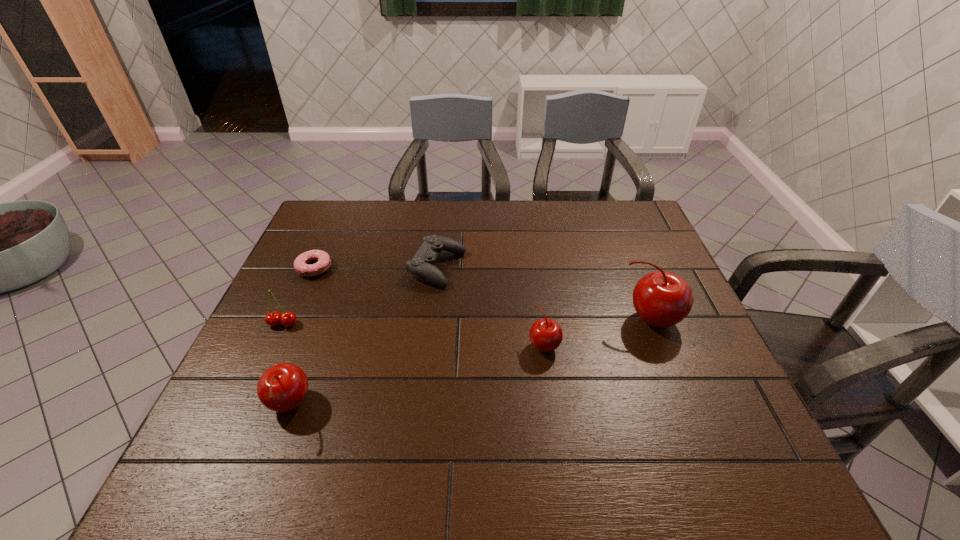
Identify the location of the third shortest cherry. Image resolution: width=960 pixels, height=540 pixels. (283, 387).

This screenshot has width=960, height=540. I want to click on the fifth shortest object, so click(x=283, y=387).

Locate an element on the screen. The height and width of the screenshot is (540, 960). the third cherry from left to right is located at coordinates (546, 335).

Locate an element on the screen. the tallest object is located at coordinates (661, 299).

You are a GUI agent. You are given a task and a screenshot of the screen. Output one action in this format:
    pyautogui.click(x=<x>, y=<y>)
    Task: Click on the rightmost cherry
    The image size is (960, 540).
    Given the screenshot: What is the action you would take?
    pyautogui.click(x=661, y=299)

At what (x,y) coordinates should I click in order to perform the action: click on control. Please return your answer as a coordinate pair (x, y). Looking at the image, I should click on (421, 264).

What are the coordinates of `the third object from right to left` in the screenshot? It's located at (421, 264).

Identify the location of the shortest object. The height and width of the screenshot is (540, 960). (301, 264).

Locate an element on the screen. The width and height of the screenshot is (960, 540). the leftmost cherry is located at coordinates (287, 319).

I want to click on free space located 0.360m on the back of the third shortest cherry, so click(x=336, y=279).